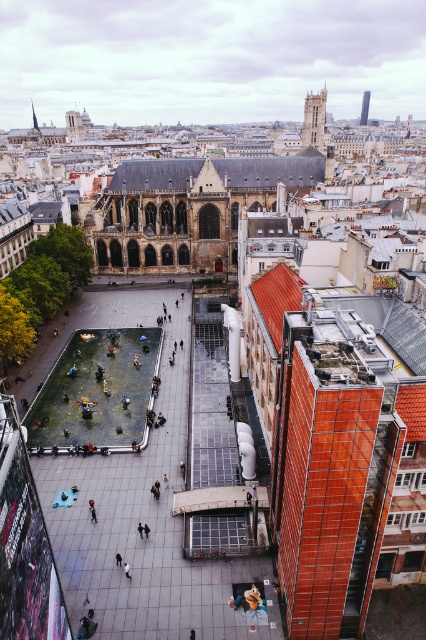
Is smooth glass tower at upper center below light gray fabric at center?

Incorrect, smooth glass tower at upper center is not positioned below light gray fabric at center.

Does smooth glass tower at upper center appear on the left side of light gray fabric at center?

No, smooth glass tower at upper center is not to the left of light gray fabric at center.

This screenshot has width=426, height=640. What do you see at coordinates (365, 108) in the screenshot?
I see `smooth glass tower at upper center` at bounding box center [365, 108].

You are a GUI agent. You are given a task and a screenshot of the screen. Output one action in this format:
    pyautogui.click(x=<x>, y=<y>)
    Task: Click on the smooth glass tower at upper center
    The height and width of the screenshot is (640, 426).
    Given the screenshot: What is the action you would take?
    pyautogui.click(x=365, y=108)

Is gray slate roof at center to the left of smooth stone tower at upper center from the viewer's perspective?

Indeed, gray slate roof at center is positioned on the left side of smooth stone tower at upper center.

Consider the image. Can you confirm if gray slate roof at center is positioned below smooth stone tower at upper center?

Yes, gray slate roof at center is below smooth stone tower at upper center.

Does point (298, 164) come behind point (305, 138)?

No, it is not.

This screenshot has width=426, height=640. I want to click on gray slate roof at center, so click(218, 172).

What do you see at coordinates (313, 120) in the screenshot? I see `smooth stone tower at upper center` at bounding box center [313, 120].

Between smooth stone tower at upper center and brown leather jacket at lower center, which one has less height?

With less height is brown leather jacket at lower center.

Is point (310, 120) closer to camera compared to point (247, 593)?

No, it is behind (247, 593).

The image size is (426, 640). In order to click on smooth stone tower at upper center in this screenshot , I will do `click(313, 120)`.